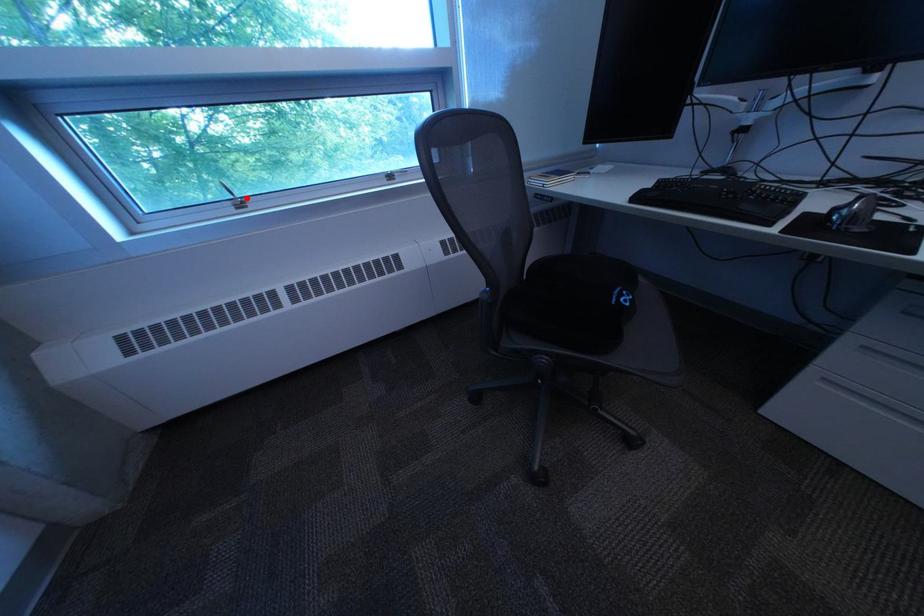
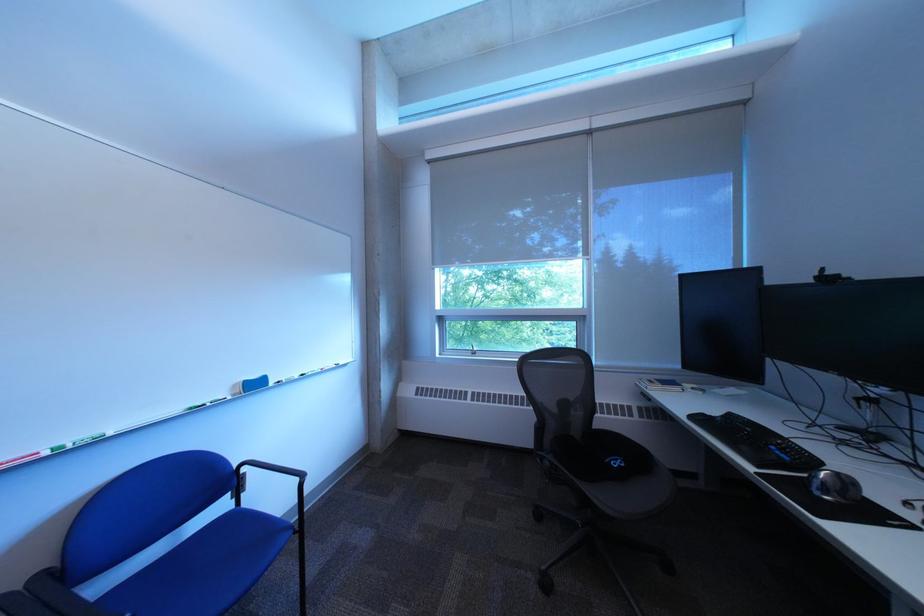
Find the pixel in the second image that matches the highlighted location in the first image.

(488, 351)